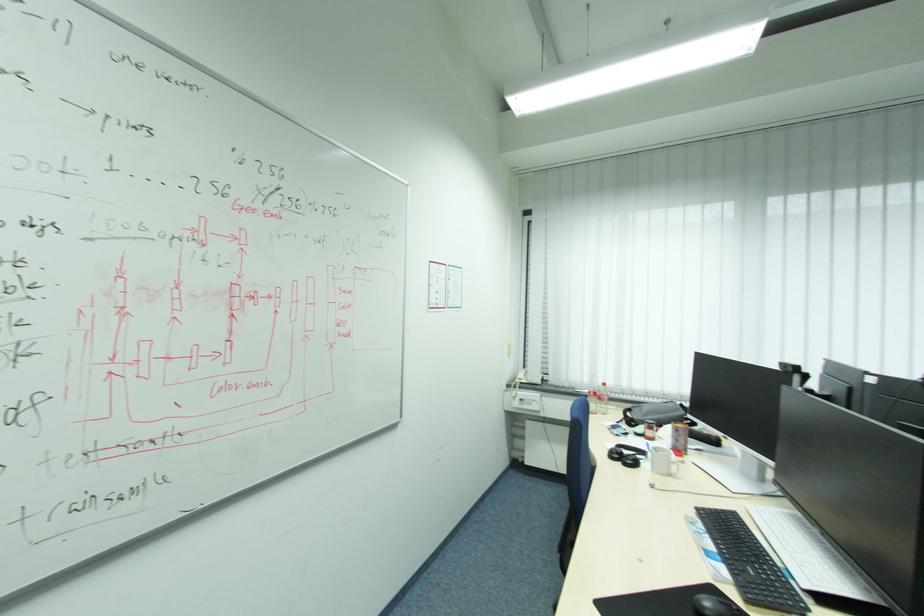
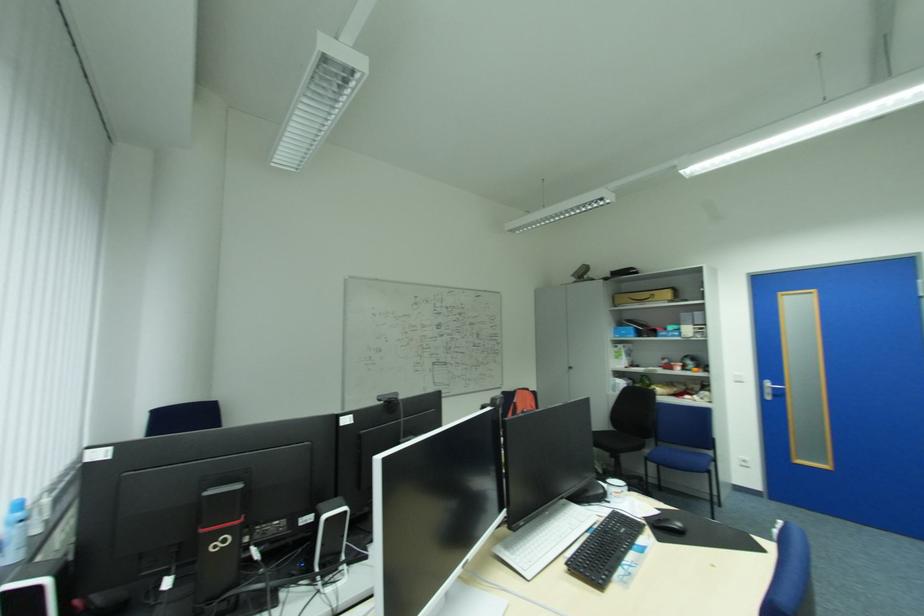
In the second image, find the point that corresponds to the point at 804,517 in the first image.

(514, 546)